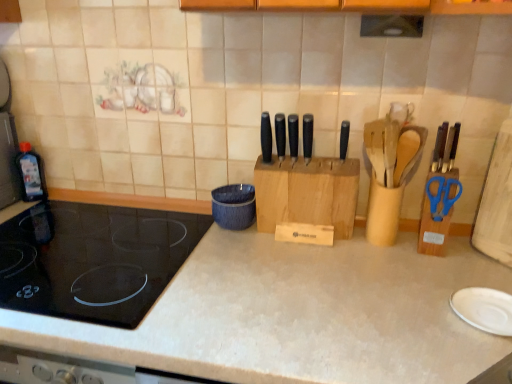
This screenshot has width=512, height=384. I want to click on free spot in front of transparent plastic bottle at left, so click(38, 210).